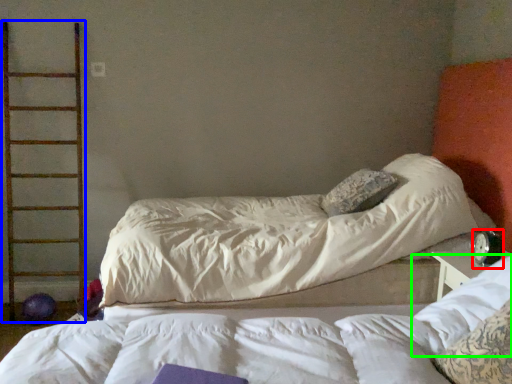
Question: Which is farther away from alarm clock (highlighted by a red box)? ladder (highlighted by a blue box) or pillow (highlighted by a green box)?

Choices:
 (A) ladder
 (B) pillow

Answer: (A)